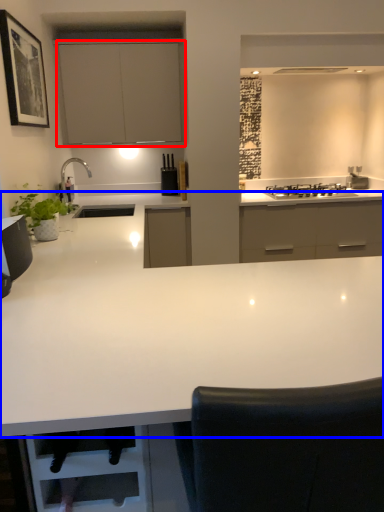
Question: Which object appears closest to the camera in this image, cabinetry (highlighted by a red box) or countertop (highlighted by a blue box)?

Choices:
 (A) cabinetry
 (B) countertop

Answer: (B)